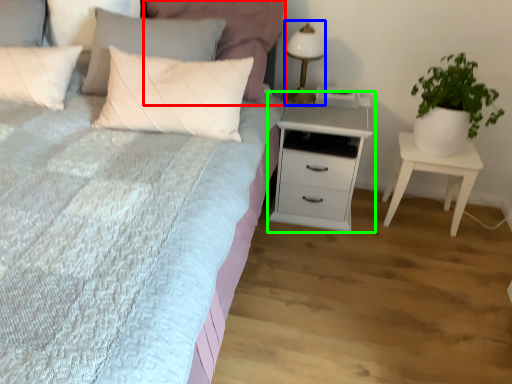
Question: Which object is positioned closest to pillow (highlighted by a red box)? Select from bedside lamp (highlighted by a blue box) and chest of drawers (highlighted by a green box).

Choices:
 (A) bedside lamp
 (B) chest of drawers

Answer: (A)